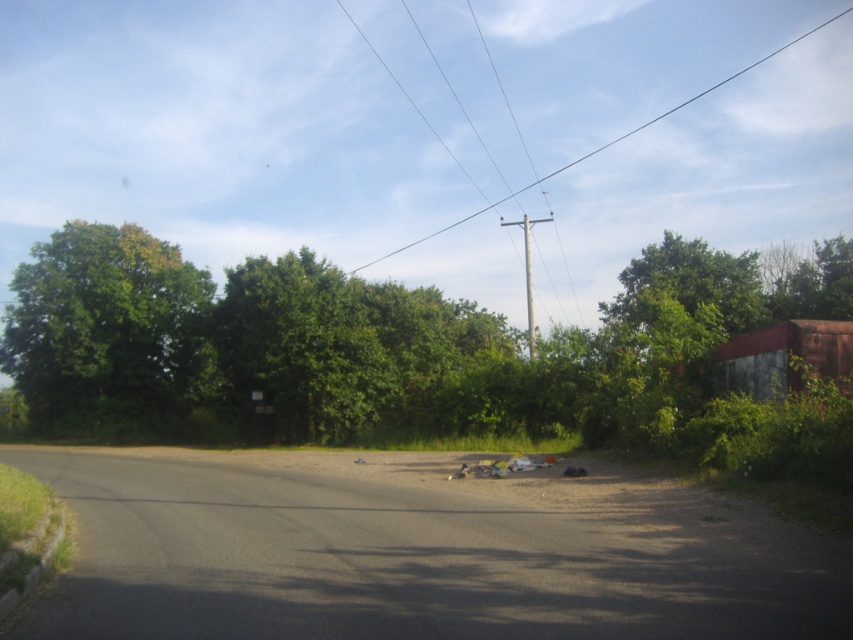
Who is more forward, (538, 179) or (450, 152)?

Point (450, 152)

Who is more distant from viewer, (744, 68) or (512, 193)?

The point (744, 68) is behind.

The image size is (853, 640). I want to click on smooth wire at upper center, so click(x=604, y=144).

Looking at this image, is green leafy tree at left below metallic wire at upper center?

Yes, green leafy tree at left is below metallic wire at upper center.

Can you confirm if green leafy tree at left is positioned to the right of metallic wire at upper center?

In fact, green leafy tree at left is to the left of metallic wire at upper center.

Which is behind, point (33, 344) or point (386, 67)?

The point (386, 67) is behind.

Find the location of a particular element. green leafy tree at left is located at coordinates (106, 326).

Which is above, green leafy tree at center or green leafy tree at left?

Positioned higher is green leafy tree at left.

Who is taller, green leafy tree at center or green leafy tree at left?

Standing taller between the two is green leafy tree at left.

Identify the location of green leafy tree at center. This screenshot has width=853, height=640. (369, 346).